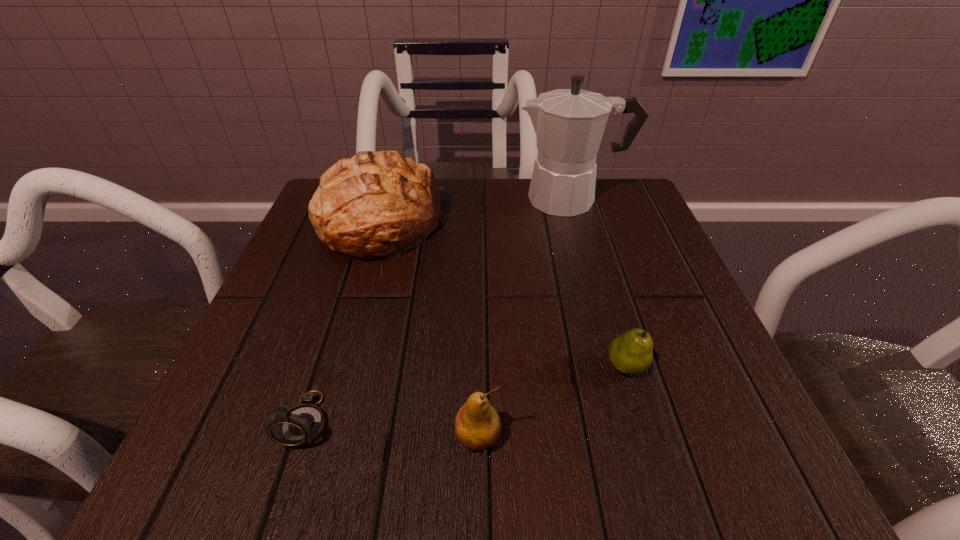
This screenshot has height=540, width=960. In order to click on free space located 0.360m on the right of the bread in this screenshot , I will do `click(611, 225)`.

Where is `free space located on the right of the left pear`? This screenshot has height=540, width=960. free space located on the right of the left pear is located at coordinates (690, 437).

The height and width of the screenshot is (540, 960). What are the coordinates of `vacant area situated 0.140m on the back of the farther pear` in the screenshot? It's located at (603, 288).

Image resolution: width=960 pixels, height=540 pixels. I want to click on coffeepot that is positioned at the far edge, so (569, 124).

The width and height of the screenshot is (960, 540). Find the location of `bread at the far edge`. bread at the far edge is located at coordinates (375, 205).

The image size is (960, 540). In order to click on pear at the near edge in this screenshot , I will do `click(477, 424)`.

You are a GUI agent. You are given a task and a screenshot of the screen. Output one action in this format:
    pyautogui.click(x=<x>, y=<y>)
    Task: Click on the compass that is at the near edge
    
    Given the screenshot: What is the action you would take?
    pyautogui.click(x=302, y=424)

Image resolution: width=960 pixels, height=540 pixels. What are the coordinates of `bread located in the left edge section of the desktop` in the screenshot? It's located at (375, 205).

Where is `compass situated at the left edge`? The width and height of the screenshot is (960, 540). compass situated at the left edge is located at coordinates (302, 424).

Image resolution: width=960 pixels, height=540 pixels. What are the coordinates of `coffeepot that is at the right edge` in the screenshot? It's located at (569, 124).